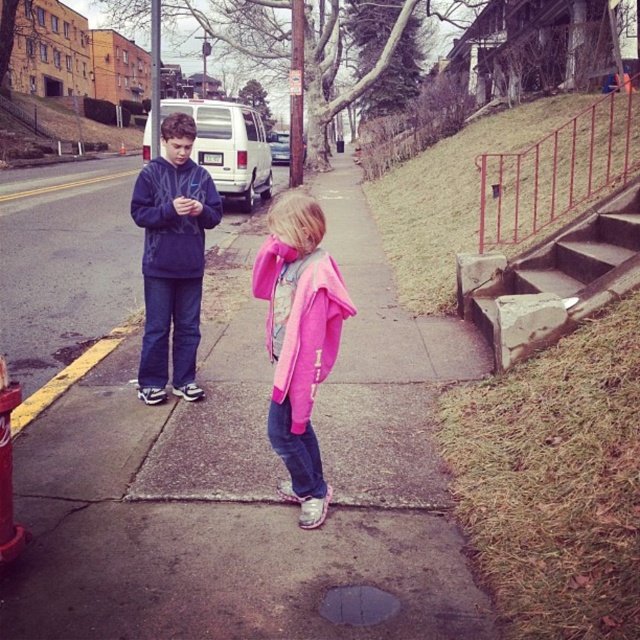
Question: Considering the real-world distances, which object is closest to the concrete sidewalk at center?

Choices:
 (A) concrete stairs at right
 (B) pink fleece jacket at center

Answer: (A)

Question: Which of the following is the closest to the observer?

Choices:
 (A) (304, 323)
 (B) (4, 458)
 (C) (577, 257)
 (D) (170, 227)

Answer: (B)

Question: Does concrete sidewalk at center appear under matte blue sweatshirt at center?

Choices:
 (A) yes
 (B) no

Answer: (A)

Question: Is concrete stairs at right bigger than matte blue sweatshirt at center?

Choices:
 (A) no
 (B) yes

Answer: (B)

Question: From the image, what is the correct spatial relationship of concrete sidewalk at center in relation to pink fleece jacket at center?

Choices:
 (A) right
 (B) left

Answer: (B)

Question: Based on their relative distances, which object is nearer to the concrete sidewalk at center?

Choices:
 (A) concrete stairs at right
 (B) brushed metal hydrant at lower left
 (C) matte blue sweatshirt at center

Answer: (C)